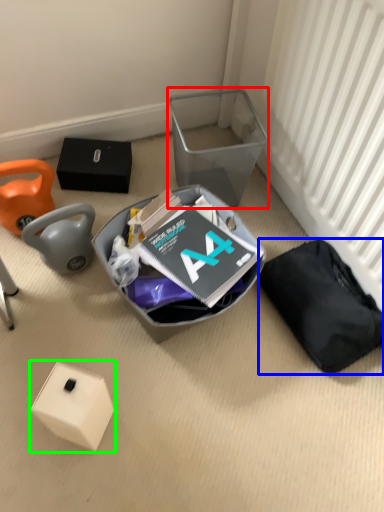
Question: Which is farther away from shoe box (highlighted by a red box)? waste (highlighted by a blue box) or box (highlighted by a green box)?

Choices:
 (A) waste
 (B) box

Answer: (B)